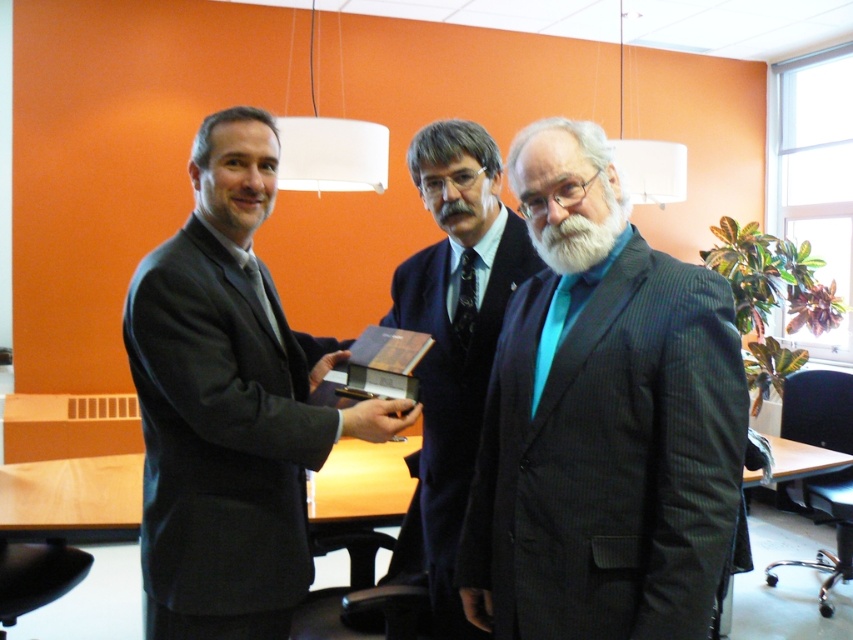
Looking at this image, you are standing in the office scene described. You see two points marked in the image. Which point is closer to you, point [236,256] or point [450,368]?

Point [236,256] is in front of point [450,368], so it is closer to you.

You are an event planner arranging seating for a meeting. You need to place two guests wearing the dark gray pinstripe suit at center and the dark blue suit at center. Which guest should you seat first to ensure proper spacing?

The dark gray pinstripe suit at center should be seated first because it is positioned over the dark blue suit at center, indicating it is closer to the front and requires priority in seating arrangement.

You are an event planner arranging seats for a meeting. You need to seat the person in the dark gray pinstripe suit at center and the person in the matte black suit at left. Which person requires a wider seat? Explain your reasoning based on their clothing descriptions.

The matte black suit at left requires a wider seat because the dark gray pinstripe suit at center has a smaller width according to the description.